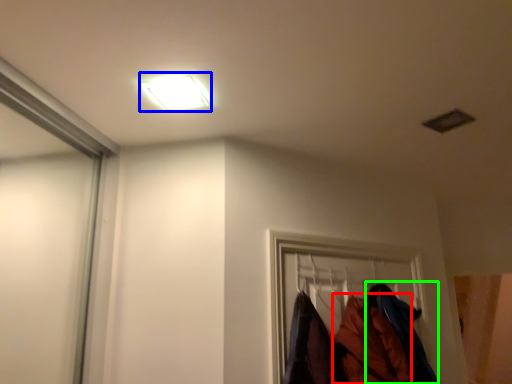
Question: Which object is the farthest from clothing (highlighted by a red box)? Choose among these: lamp (highlighted by a blue box) or clothing (highlighted by a green box).

Choices:
 (A) lamp
 (B) clothing

Answer: (A)